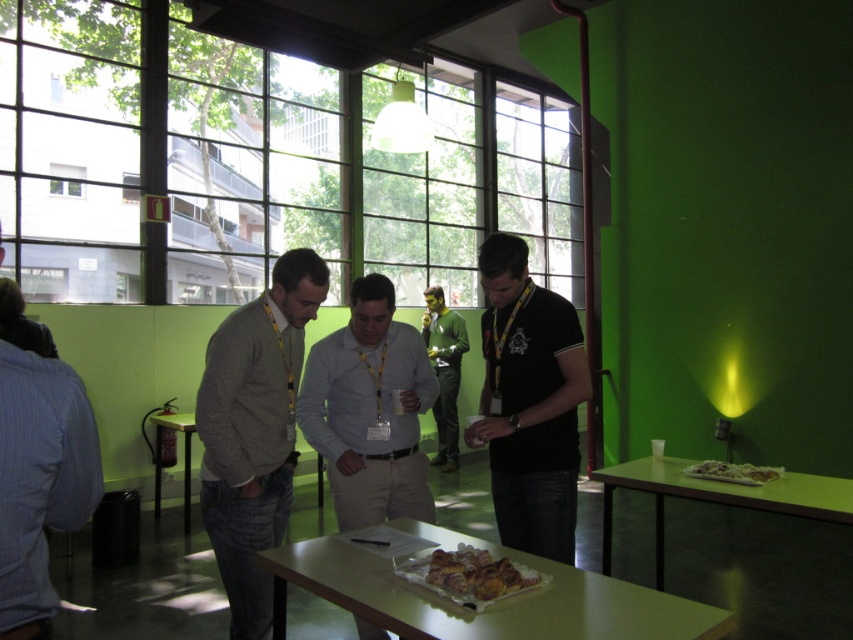
You are organizing a small event and need to place a 1.2 meter wide banner between the green matte table at lower right and the black matte shirt at center. Can the banner fit between them based on their widths?

The green matte table at lower right is wider than the black matte shirt at center. However, the banner requires 1.2 meters of space, but the description only compares their widths without providing exact measurements. Therefore, it is impossible to determine if the banner will fit solely based on the given information.

You are at the table with the gray sweater at center and the light gray shirt at center. Which clothing item is closer to you?

The gray sweater at center is closer to you because it is positioned under the light gray shirt at center, meaning it is in a lower spatial position relative to the observer.